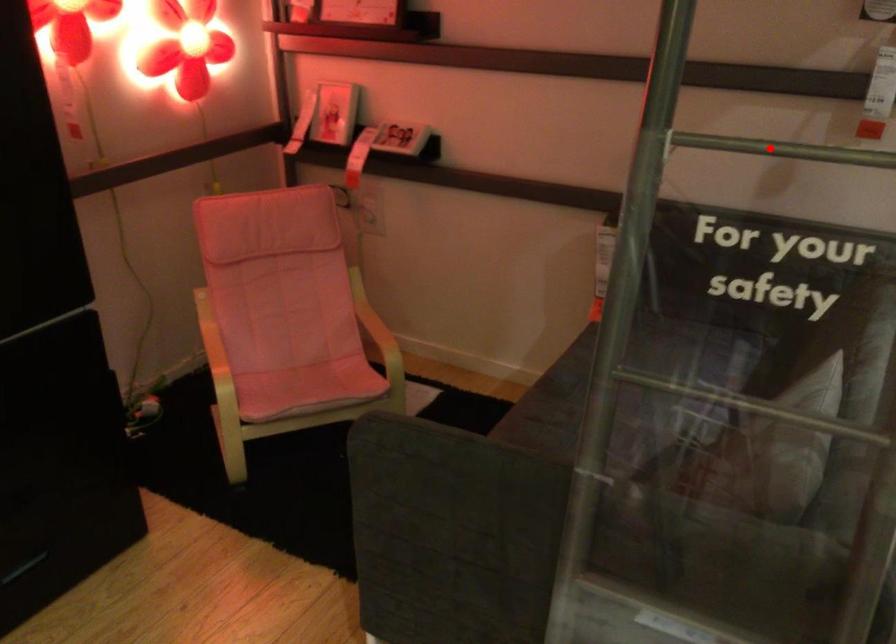
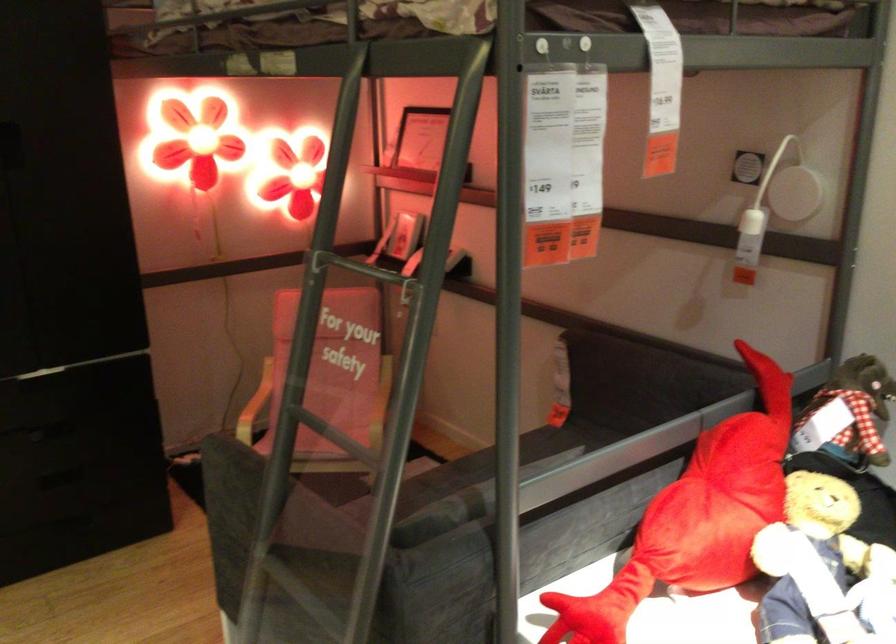
Find the pixel in the second image that matches the highlighted location in the first image.

(354, 267)